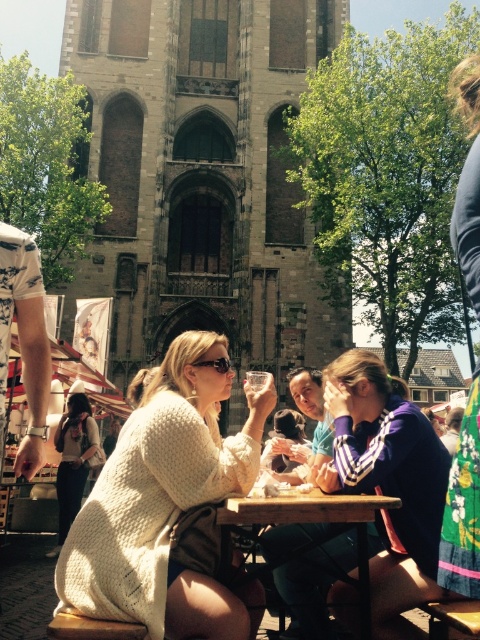
Can you confirm if white knitted sweater at center is wider than knitted sweater at center?

Yes.

Is white knitted sweater at center positioned before knitted sweater at center?

Yes, it is.

Which is in front, point (196, 630) or point (57, 493)?

Point (196, 630) is in front.

Find the location of a particular element. The height and width of the screenshot is (640, 480). white knitted sweater at center is located at coordinates (167, 502).

Can you confirm if purple jersey at center is positioned above wooden table at center?

Indeed, purple jersey at center is positioned over wooden table at center.

Can you confirm if purple jersey at center is positioned to the right of wooden table at center?

Correct, you'll find purple jersey at center to the right of wooden table at center.

Locate an element on the screen. purple jersey at center is located at coordinates (386, 460).

Between point (141, 582) and point (280, 419), which one is positioned behind?

The point (280, 419) is behind.

Can you confirm if white knitted sweater at center is shorter than soft white sweater at center?

No.

This screenshot has width=480, height=640. I want to click on white knitted sweater at center, so click(x=167, y=502).